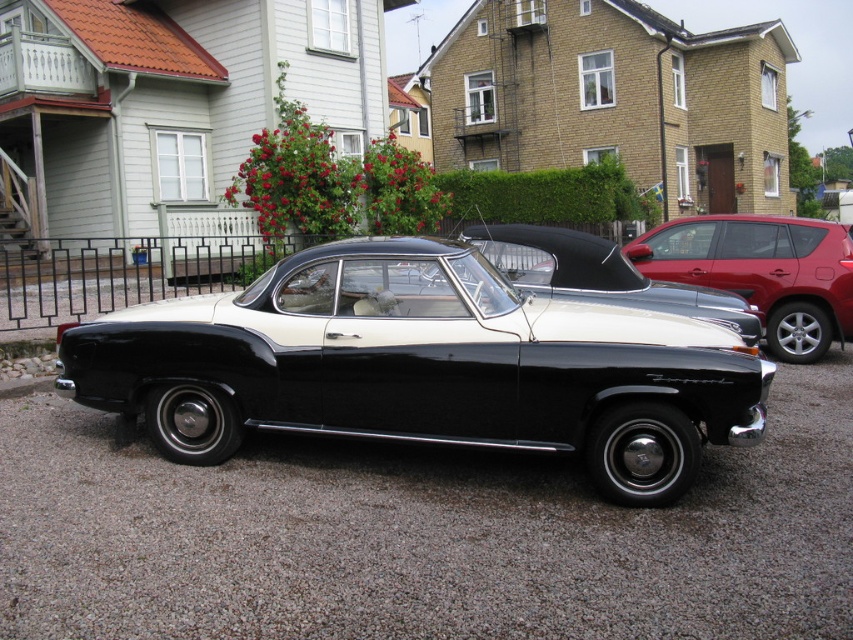
You are a delivery person trying to decide which vehicle to park closer to the mailbox. The mailbox is located between the two houses. The black glossy car at center is currently parked in front of the left house, and the glossy red suv at right is parked in front of the right house. Which vehicle should you move to be closer to the mailbox?

The black glossy car at center has a lesser height compared to the glossy red suv at right, so you should move the black glossy car at center to be closer to the mailbox since it is shorter and less likely to block the mailbox view.